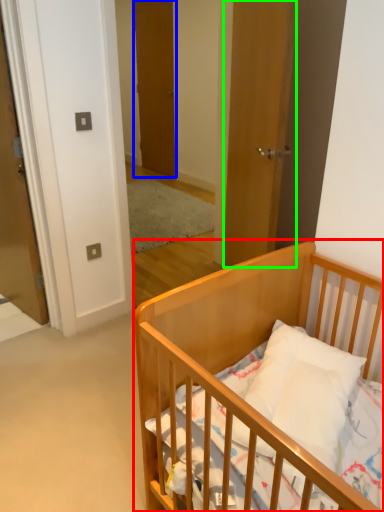
Question: Considering the real-world distances, which object is closest to infant bed (highlighted by a red box)? door (highlighted by a blue box) or door (highlighted by a green box).

Choices:
 (A) door
 (B) door

Answer: (B)